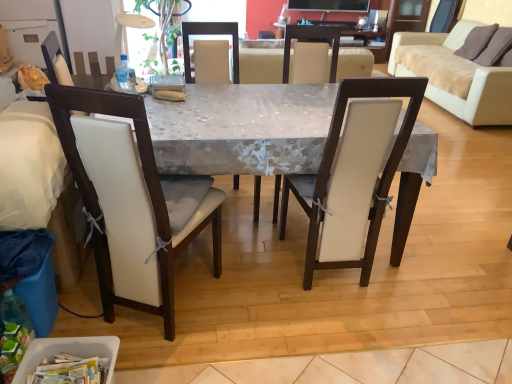
Locate an element on the screen. vacant region to the left of white leather chair at center, placed as the first chair when sorted from right to left is located at coordinates 249,267.